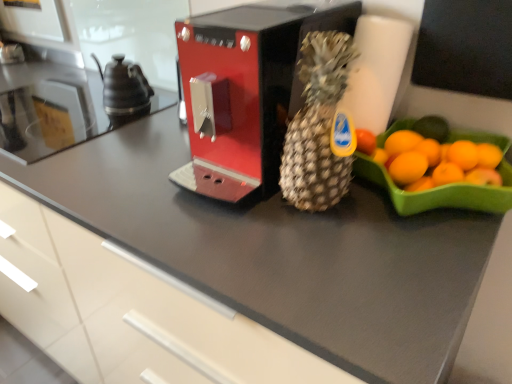
Question: Should I look upward or downward to see metallic red coffee machine at center?

Choices:
 (A) up
 (B) down

Answer: (A)

Question: Is metallic red coffee machine at center closer to the viewer compared to satin black countertop at left?

Choices:
 (A) yes
 (B) no

Answer: (A)

Question: Is metallic red coffee machine at center to the left of satin black countertop at left from the viewer's perspective?

Choices:
 (A) no
 (B) yes

Answer: (A)

Question: Is there a large distance between metallic red coffee machine at center and satin black countertop at left?

Choices:
 (A) yes
 (B) no

Answer: (B)

Question: Considering the relative sizes of metallic red coffee machine at center and satin black countertop at left in the image provided, is metallic red coffee machine at center thinner than satin black countertop at left?

Choices:
 (A) yes
 (B) no

Answer: (B)

Question: Can you confirm if metallic red coffee machine at center is smaller than satin black countertop at left?

Choices:
 (A) no
 (B) yes

Answer: (A)

Question: Is metallic red coffee machine at center wider than satin black countertop at left?

Choices:
 (A) yes
 (B) no

Answer: (A)

Question: From the image's perspective, does black ceramic tea pot at left appear lower than satin black countertop at left?

Choices:
 (A) yes
 (B) no

Answer: (B)

Question: Can you confirm if black ceramic tea pot at left is shorter than satin black countertop at left?

Choices:
 (A) yes
 (B) no

Answer: (B)

Question: Considering the relative positions of black ceramic tea pot at left and satin black countertop at left in the image provided, is black ceramic tea pot at left behind satin black countertop at left?

Choices:
 (A) no
 (B) yes

Answer: (B)

Question: From a real-world perspective, is black ceramic tea pot at left physically above satin black countertop at left?

Choices:
 (A) no
 (B) yes

Answer: (B)

Question: Is black ceramic tea pot at left facing towards satin black countertop at left?

Choices:
 (A) yes
 (B) no

Answer: (A)

Question: Does black ceramic tea pot at left contain satin black countertop at left?

Choices:
 (A) yes
 (B) no

Answer: (B)

Question: From a real-world perspective, is brown textured pineapple at center physically above metallic red coffee machine at center?

Choices:
 (A) no
 (B) yes

Answer: (B)